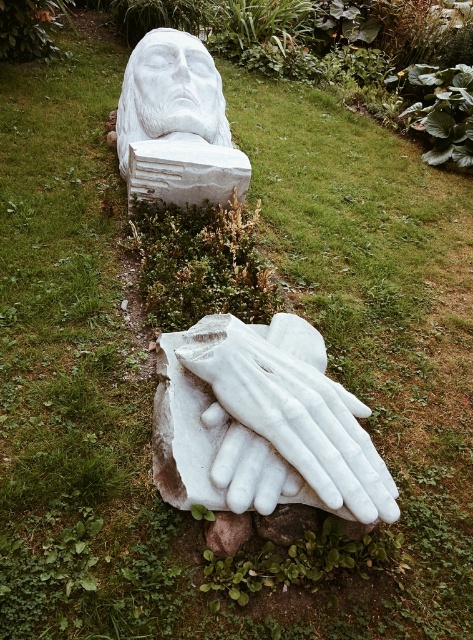
Identify the location of white marble head at upper center. The height and width of the screenshot is (640, 473). (171, 92).

Consider the image. Is white marble head at upper center shorter than brown rough stone at lower center?

No, white marble head at upper center is not shorter than brown rough stone at lower center.

Is point (131, 120) farther from camera compared to point (241, 540)?

That is True.

What are the coordinates of `white marble head at upper center` in the screenshot? It's located at (171, 92).

Who is more distant from viewer, (292,454) or (246,531)?

Positioned behind is point (246,531).

Does white marble hand at center appear under brown rough stone at lower center?

Actually, white marble hand at center is above brown rough stone at lower center.

Identify the location of white marble hand at center. The image size is (473, 640). point(285,419).

You are a GUI agent. You are given a task and a screenshot of the screen. Output one action in this format:
    pyautogui.click(x=<x>, y=<y>)
    Task: Click on the white marble hand at center
    The height and width of the screenshot is (640, 473).
    Given the screenshot: What is the action you would take?
    pyautogui.click(x=285, y=419)

Identify the location of white marble head at upper center. pyautogui.click(x=171, y=92).

The width and height of the screenshot is (473, 640). Identify the location of white marble head at upper center. (171, 92).

The height and width of the screenshot is (640, 473). I want to click on white marble head at upper center, so click(171, 92).